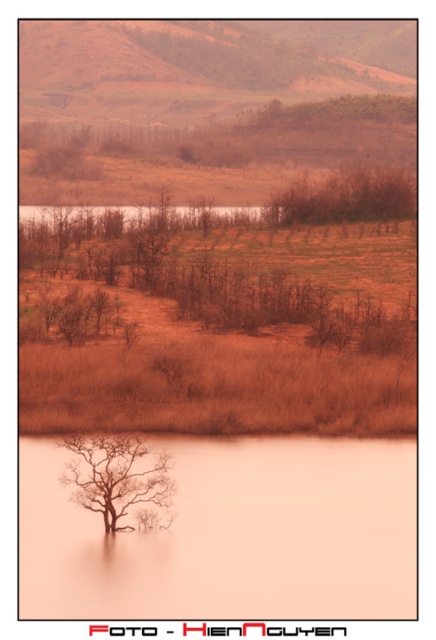
Question: Does brown grassland at center appear over translucent orange flood at center?

Choices:
 (A) yes
 (B) no

Answer: (A)

Question: Is translucent orange flood at center wider than brown matte tree at center?

Choices:
 (A) yes
 (B) no

Answer: (A)

Question: Which point is closer to the camera?

Choices:
 (A) brown matte tree at lower center
 (B) translucent orange flood at center

Answer: (B)

Question: Is brown grassland at center behind brown matte tree at lower center?

Choices:
 (A) yes
 (B) no

Answer: (A)

Question: Which of these objects is positioned farthest from the brown grassland at center?

Choices:
 (A) brown matte tree at lower center
 (B) translucent orange flood at center
 (C) brown matte tree at center

Answer: (A)

Question: Which object is the farthest from the brown matte tree at center?

Choices:
 (A) brown grassland at center
 (B) brown matte tree at lower center
 (C) translucent orange flood at center

Answer: (B)